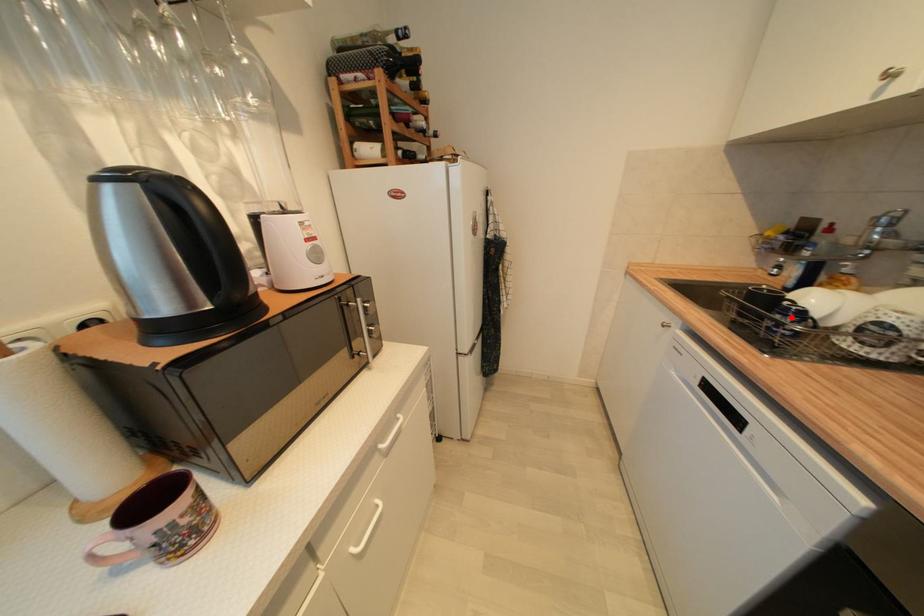
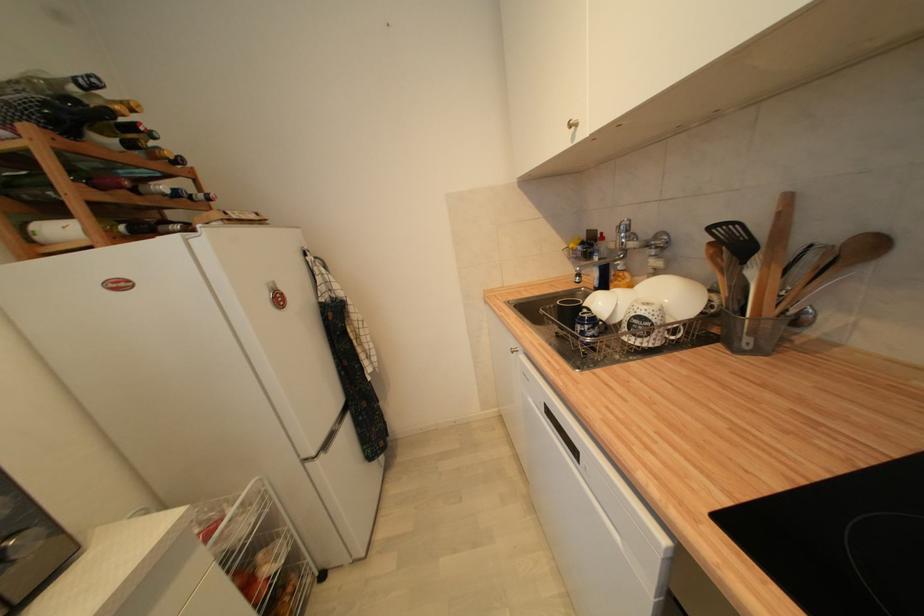
In the second image, find the point that corresponds to the highlighted location in the first image.

(588, 326)